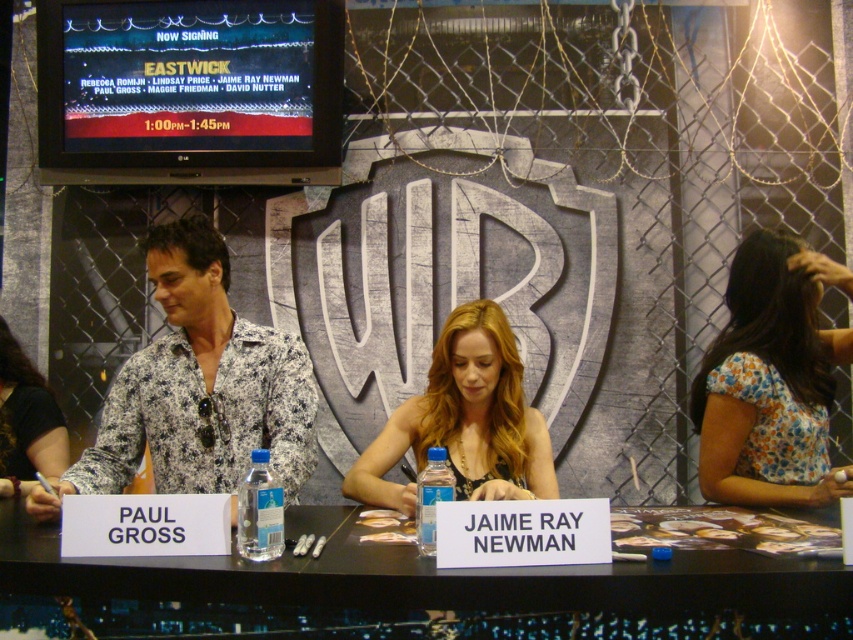
Question: Which object is the farthest from the black fabric shirt at left?

Choices:
 (A) white plastic table at center
 (B) floral fabric blouse at right

Answer: (B)

Question: Which is farther from the floral fabric blouse at right?

Choices:
 (A) floral-patterned shirt at center
 (B) blonde hair at center
 (C) white plastic table at center
 (D) black fabric shirt at left

Answer: (D)

Question: Can you confirm if white plastic table at center is positioned below floral fabric blouse at right?

Choices:
 (A) yes
 (B) no

Answer: (A)

Question: Is white plastic table at center to the right of floral fabric blouse at right from the viewer's perspective?

Choices:
 (A) yes
 (B) no

Answer: (B)

Question: Estimate the real-world distances between objects in this image. Which object is closer to the black fabric shirt at left?

Choices:
 (A) white plastic table at center
 (B) floral fabric blouse at right

Answer: (A)

Question: Does white plastic table at center appear under floral-patterned shirt at center?

Choices:
 (A) no
 (B) yes

Answer: (B)